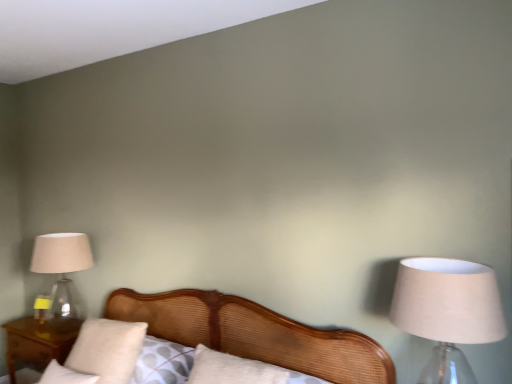
Question: Does wooden nightstand at lower left have a lesser height compared to beige fabric lampshade at right, acting as the 1th lamp starting from the right?

Choices:
 (A) yes
 (B) no

Answer: (A)

Question: From a real-world perspective, is wooden nightstand at lower left positioned over beige fabric lampshade at right, the second lamp when ordered from back to front, based on gravity?

Choices:
 (A) yes
 (B) no

Answer: (B)

Question: Are wooden nightstand at lower left and beige fabric lampshade at right, the 1th lamp when ordered from front to back, located far from each other?

Choices:
 (A) no
 (B) yes

Answer: (B)

Question: Considering the relative sizes of wooden nightstand at lower left and beige fabric lampshade at right, acting as the 1th lamp starting from the right, in the image provided, is wooden nightstand at lower left taller than beige fabric lampshade at right, acting as the 1th lamp starting from the right,?

Choices:
 (A) no
 (B) yes

Answer: (A)

Question: Could you tell me if wooden nightstand at lower left is facing beige fabric lampshade at right, positioned as the second lamp in left-to-right order?

Choices:
 (A) yes
 (B) no

Answer: (B)

Question: From a real-world perspective, is wooden nightstand at lower left positioned under beige fabric lampshade at right, the 1th lamp when ordered from front to back, based on gravity?

Choices:
 (A) no
 (B) yes

Answer: (B)

Question: From a real-world perspective, is clear glass lampshade at left, the second lamp viewed from the front, beneath beige fabric lampshade at right, positioned as the second lamp in left-to-right order?

Choices:
 (A) no
 (B) yes

Answer: (B)

Question: Is clear glass lampshade at left, the first lamp from the back, in contact with beige fabric lampshade at right, acting as the 1th lamp starting from the right?

Choices:
 (A) yes
 (B) no

Answer: (B)

Question: Is clear glass lampshade at left, positioned as the first lamp in left-to-right order, surrounding beige fabric lampshade at right, positioned as the second lamp in left-to-right order?

Choices:
 (A) yes
 (B) no

Answer: (B)

Question: Considering the relative positions of clear glass lampshade at left, positioned as the first lamp in left-to-right order, and beige fabric lampshade at right, the 1th lamp when ordered from front to back, in the image provided, is clear glass lampshade at left, positioned as the first lamp in left-to-right order, to the right of beige fabric lampshade at right, the 1th lamp when ordered from front to back, from the viewer's perspective?

Choices:
 (A) yes
 (B) no

Answer: (B)

Question: From the image's perspective, is clear glass lampshade at left, placed as the 2th lamp when sorted from right to left, on beige fabric lampshade at right, positioned as the second lamp in left-to-right order?

Choices:
 (A) yes
 (B) no

Answer: (B)

Question: Is clear glass lampshade at left, placed as the 2th lamp when sorted from right to left, further to camera compared to beige fabric lampshade at right, acting as the 1th lamp starting from the right?

Choices:
 (A) no
 (B) yes

Answer: (B)

Question: Is wooden nightstand at lower left to the right of white soft pillow at lower left, which ranks as the second pillow in top-to-bottom order, from the viewer's perspective?

Choices:
 (A) yes
 (B) no

Answer: (B)